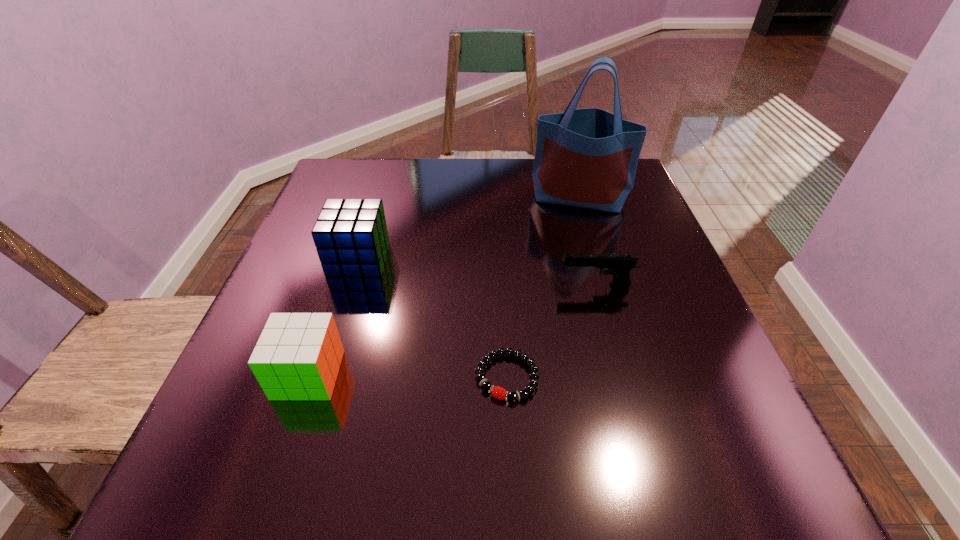
Where is `unoccupied area between the second shortest object and the farthest object`? Image resolution: width=960 pixels, height=540 pixels. unoccupied area between the second shortest object and the farthest object is located at coordinates (588, 242).

Where is `empty space between the second shortest object and the handbag`? This screenshot has width=960, height=540. empty space between the second shortest object and the handbag is located at coordinates (588, 242).

Image resolution: width=960 pixels, height=540 pixels. What are the coordinates of `free area in between the farther cube and the farthest object` in the screenshot? It's located at (468, 228).

Where is `unoccupied area between the nearer cube and the third object from left to right`? unoccupied area between the nearer cube and the third object from left to right is located at coordinates (408, 376).

I want to click on free space that is in between the nearer cube and the farther cube, so click(334, 317).

Locate an element on the screen. Image resolution: width=960 pixels, height=540 pixels. empty location between the shortest object and the tallest object is located at coordinates (543, 287).

At what (x,y) coordinates should I click in order to perform the action: click on object that is the third closest to the third nearest object. Please return your answer as a coordinate pair (x, y). Image resolution: width=960 pixels, height=540 pixels. Looking at the image, I should click on (351, 238).

This screenshot has width=960, height=540. I want to click on the fourth closest object to the pistol, so coord(298,355).

I want to click on free space that satisfies the following two spatial constraints: 1. on the back side of the handbag; 2. on the left side of the bracelet, so click(x=497, y=198).

Identify the location of free space that satisfies the following two spatial constraints: 1. on the front side of the second farthest object; 2. on the left side of the shortest object. This screenshot has height=540, width=960. (323, 377).